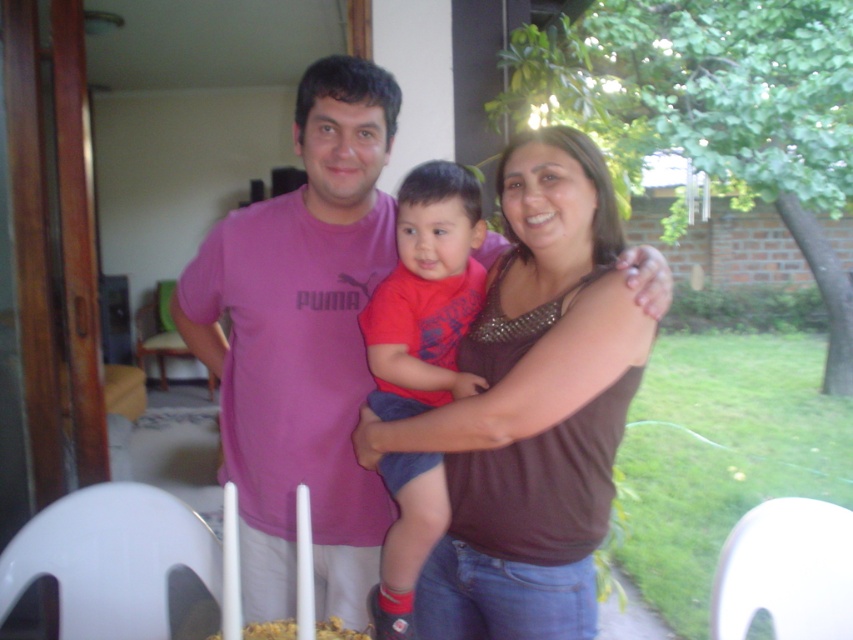
Question: Which object is the closest to the red cotton shirt at center?

Choices:
 (A) brown textured tank top at center
 (B) pink cotton t-shirt at center

Answer: (A)

Question: Where is brown textured tank top at center located in relation to red cotton shirt at center in the image?

Choices:
 (A) above
 (B) below

Answer: (A)

Question: Can you confirm if pink cotton t-shirt at center is bigger than red cotton shirt at center?

Choices:
 (A) no
 (B) yes

Answer: (B)

Question: Which point is closer to the camera?

Choices:
 (A) (238, 499)
 (B) (416, 488)

Answer: (B)

Question: Can you confirm if pink cotton t-shirt at center is positioned to the left of red cotton shirt at center?

Choices:
 (A) no
 (B) yes

Answer: (B)

Question: Which point is closer to the camera?

Choices:
 (A) brown textured tank top at center
 (B) pink cotton t-shirt at center
 (C) red cotton shirt at center

Answer: (A)